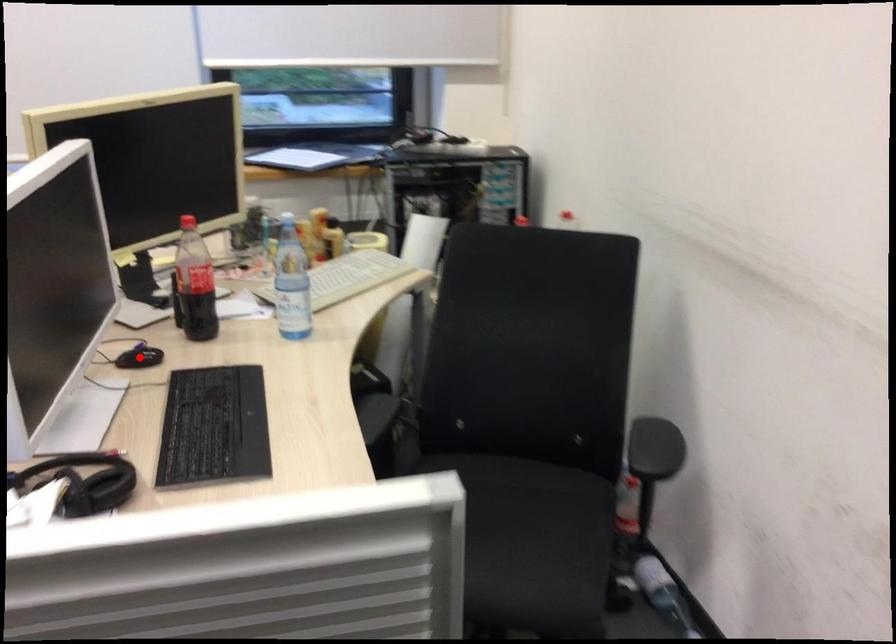
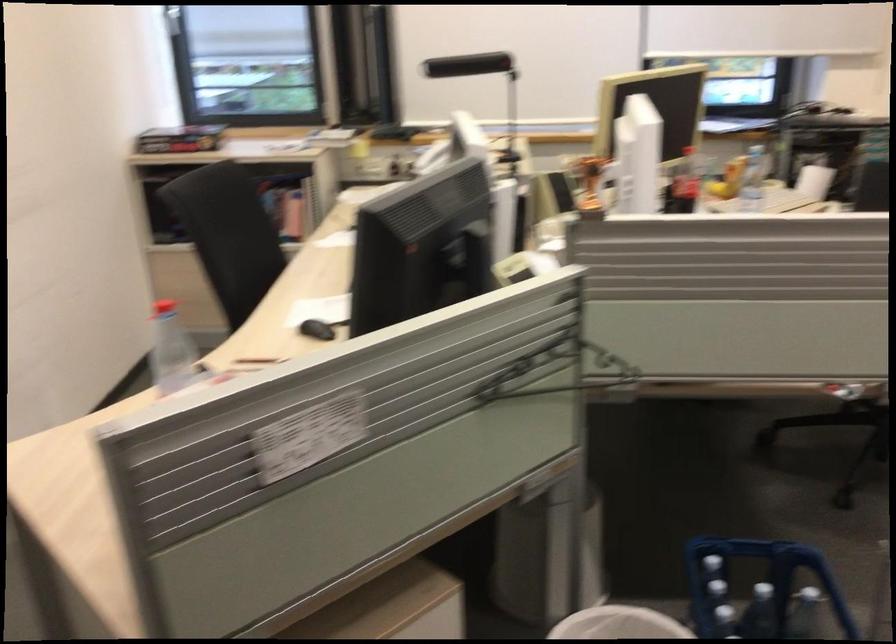
Question: I am providing you with two images of the same scene from different viewpoints. A red point is marked on the first image. Can you still see the location of the red point in image 2?

Choices:
 (A) Yes
 (B) No

Answer: (B)